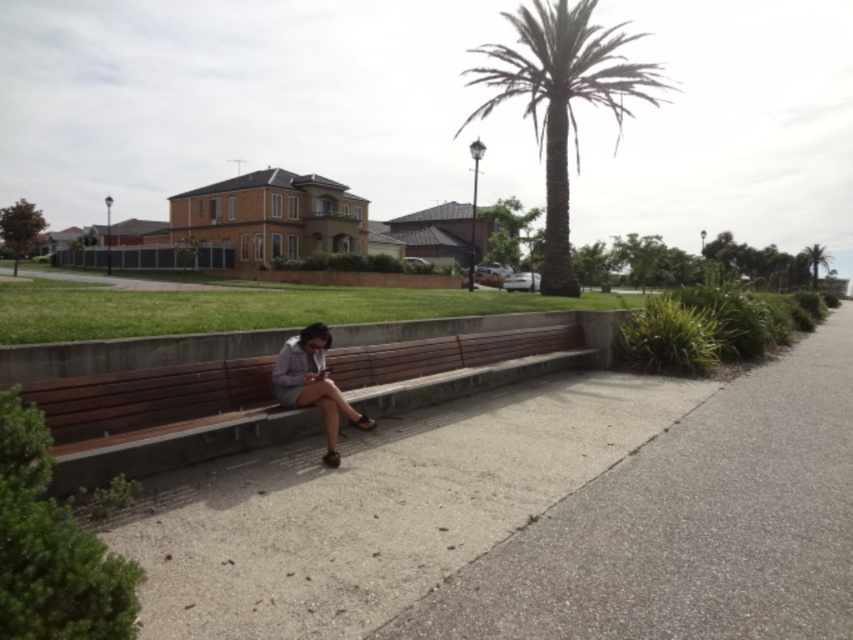
How much distance is there between brown wooden bench at center and green leafy palm tree at upper right?

brown wooden bench at center is 402.37 feet from green leafy palm tree at upper right.

Who is higher up, brown wooden bench at center or green leafy palm tree at upper right?

green leafy palm tree at upper right is higher up.

The image size is (853, 640). I want to click on brown wooden bench at center, so click(x=161, y=419).

Between gray concrete pavement at center and brown wooden bench at center, which one has less height?

brown wooden bench at center is shorter.

Does gray concrete pavement at center appear on the left side of brown wooden bench at center?

No, gray concrete pavement at center is not to the left of brown wooden bench at center.

Which is behind, point (672, 524) or point (131, 376)?

The point (131, 376) is behind.

You are a GUI agent. You are given a task and a screenshot of the screen. Output one action in this format:
    pyautogui.click(x=<x>, y=<y>)
    Task: Click on the gray concrete pavement at center
    
    Given the screenshot: What is the action you would take?
    pyautogui.click(x=688, y=525)

What do you see at coordinates (312, 385) in the screenshot? I see `matte gray shirt at center` at bounding box center [312, 385].

Can you confirm if matte gray shirt at center is smaller than green leafy palm tree at upper right?

Correct, matte gray shirt at center occupies less space than green leafy palm tree at upper right.

Does point (296, 346) come in front of point (817, 266)?

That is True.

I want to click on matte gray shirt at center, so click(x=312, y=385).